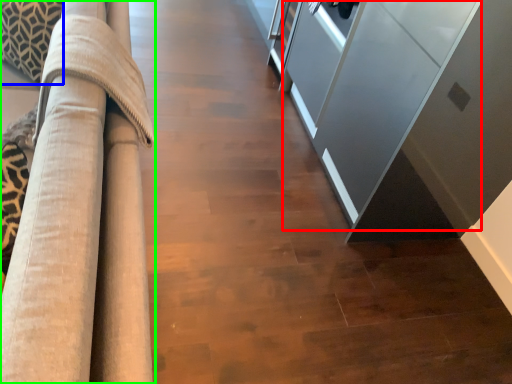
Question: Considering the real-world distances, which object is farthest from glass door (highlighted by a red box)? pillow (highlighted by a blue box) or furniture (highlighted by a green box)?

Choices:
 (A) pillow
 (B) furniture

Answer: (A)